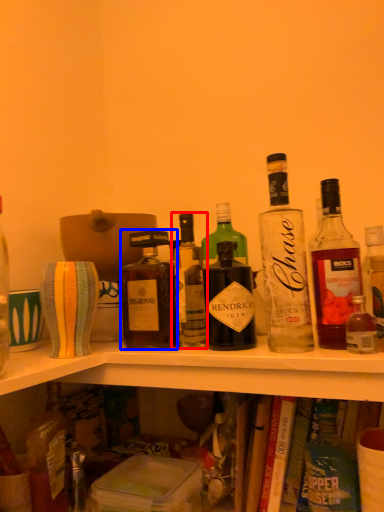
Question: Which point is further to the camera, bottle (highlighted by a red box) or bottle (highlighted by a blue box)?

Choices:
 (A) bottle
 (B) bottle

Answer: (B)